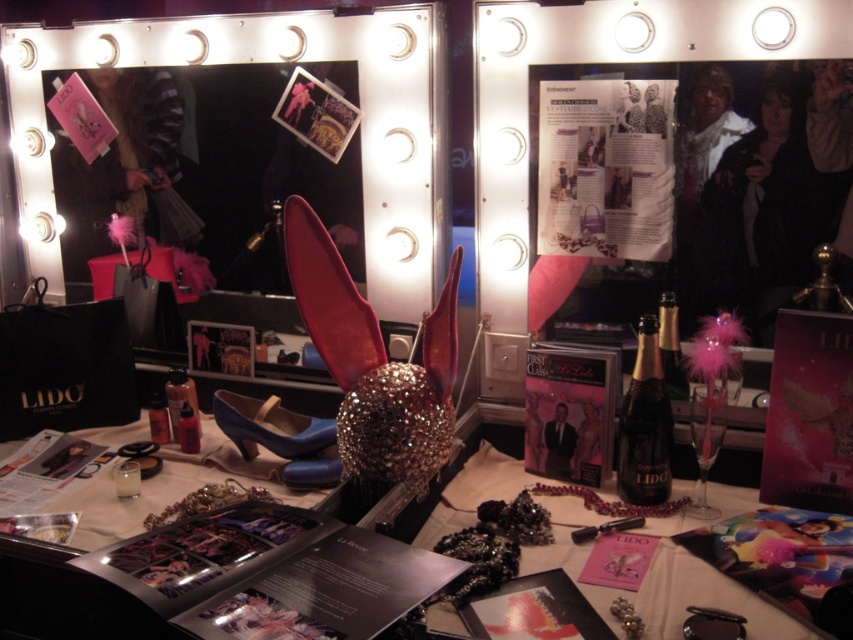
Is point (175, 22) positioned before point (241, 428)?

No, (175, 22) is behind (241, 428).

What do you see at coordinates (271, 61) in the screenshot?
I see `metallic silver mirror at center` at bounding box center [271, 61].

At what (x,y) coordinates should I click in order to perform the action: click on metallic silver mirror at center. Please return your answer as a coordinate pair (x, y). The width and height of the screenshot is (853, 640). Looking at the image, I should click on (271, 61).